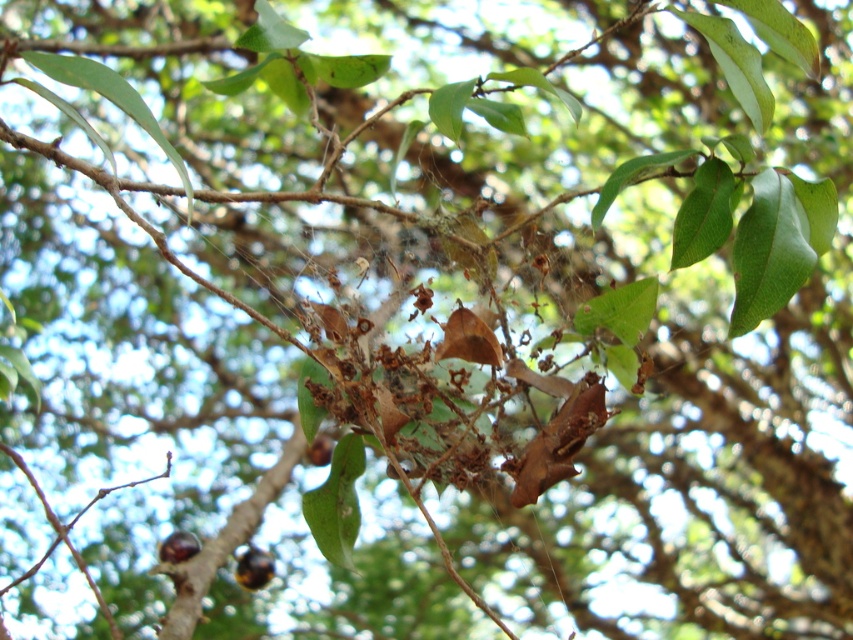
Can you confirm if shiny brown nut at lower center is shorter than brown matte fruit at center?

Correct, shiny brown nut at lower center is not as tall as brown matte fruit at center.

Which is behind, point (251, 573) or point (312, 448)?

Positioned behind is point (312, 448).

Who is more forward, (241, 563) or (316, 445)?

Point (241, 563)

Where is `shiny brown nut at lower center`? The image size is (853, 640). shiny brown nut at lower center is located at coordinates (253, 568).

Can you confirm if shiny brown nut at lower center is taller than shiny brown nut at lower left?

In fact, shiny brown nut at lower center may be shorter than shiny brown nut at lower left.

Is point (254, 589) behind point (172, 550)?

Yes, point (254, 589) is behind point (172, 550).

The width and height of the screenshot is (853, 640). Identify the location of shiny brown nut at lower center. (253, 568).

Can you confirm if shiny brown nut at lower left is positioned above brown matte fruit at center?

No, shiny brown nut at lower left is not above brown matte fruit at center.

Between point (192, 534) and point (320, 464), which one is positioned in front?

Point (192, 534) is more forward.

Is point (164, 541) farther from camera compared to point (328, 438)?

No, (164, 541) is in front of (328, 438).

Find the location of a particular element. Image resolution: width=853 pixels, height=640 pixels. shiny brown nut at lower left is located at coordinates [x=178, y=547].